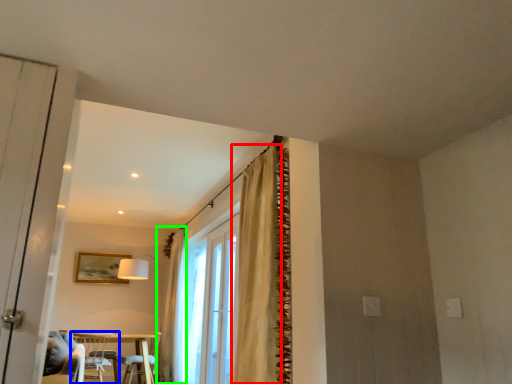
Question: Based on their relative distances, which object is farther from curtain (highlighted by a red box)? Choose from chair (highlighted by a blue box) and curtain (highlighted by a green box).

Choices:
 (A) chair
 (B) curtain

Answer: (A)